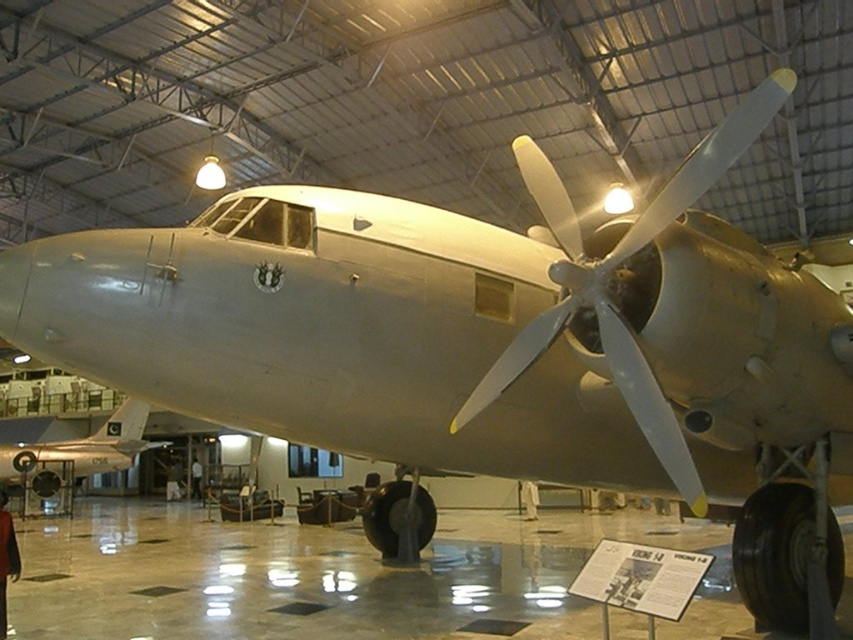
You are a museum visitor standing near the vintage aircraft. You see the dark brown leather jacket at lower left and the black leather chair at center. Which object is closer to you?

The dark brown leather jacket at lower left is closer to you because it is in front of the black leather chair at center.

You are a museum visitor standing in front of the aircraft display. You notice the metallic silver propeller at center and the dark brown leather jacket at lower left. Which object is located higher in the image?

The metallic silver propeller at center is positioned over the dark brown leather jacket at lower left, so it is higher in the image.

You are a security guard in the museum and need to place a small fire extinguisher between the metallic silver airplane at lower left and the dark brown leather jacket at lower left. Considering their sizes, will the fire extinguisher fit comfortably between them?

The metallic silver airplane at lower left occupies less space than dark brown leather jacket at lower left. Therefore, there should be enough space between them to place the fire extinguisher comfortably.